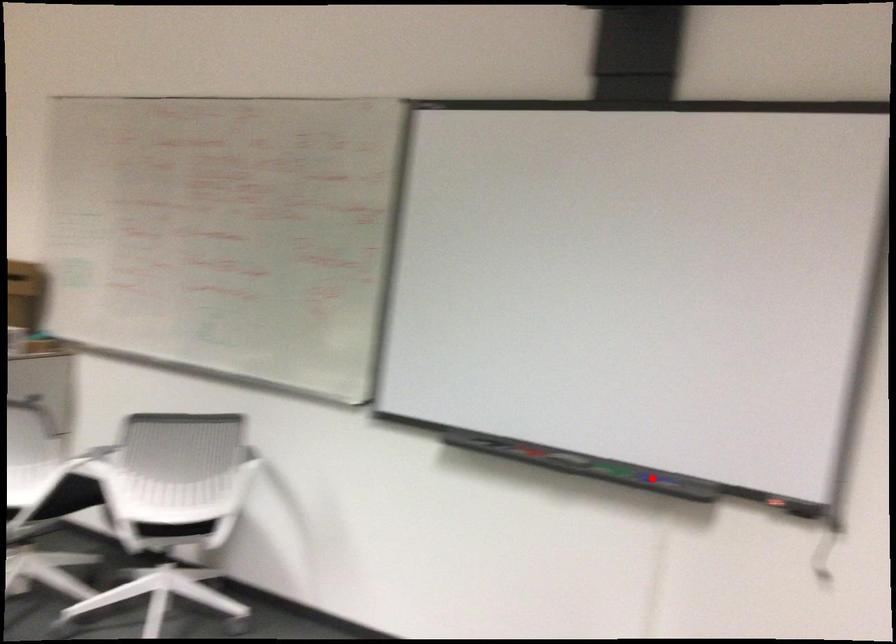
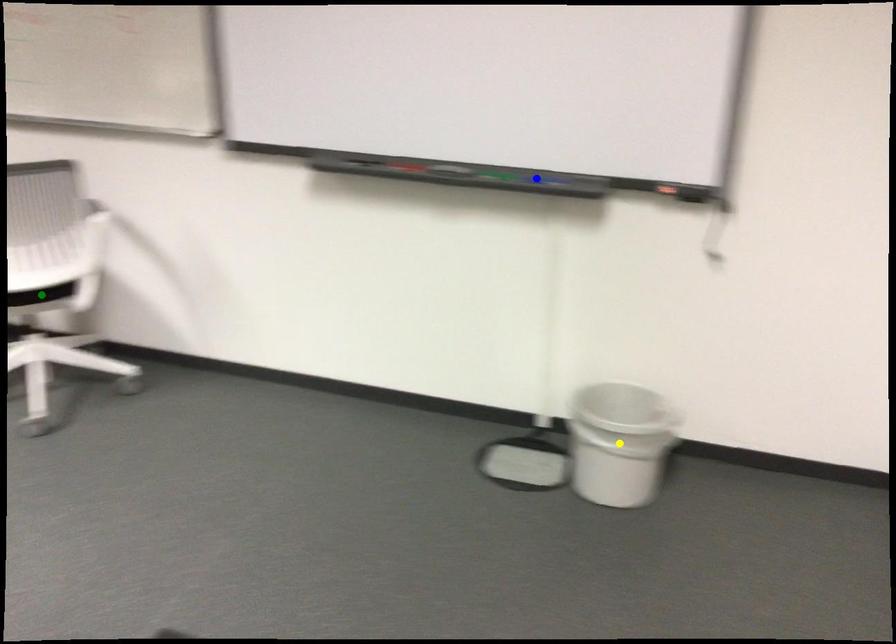
Question: I am providing you with two images of the same scene from different viewpoints. A red point is marked on the first image. You are given multiple points on the second image. Which point in image 2 is actually the same real-world point as the red point in image 1?

Choices:
 (A) green point
 (B) yellow point
 (C) blue point

Answer: (C)